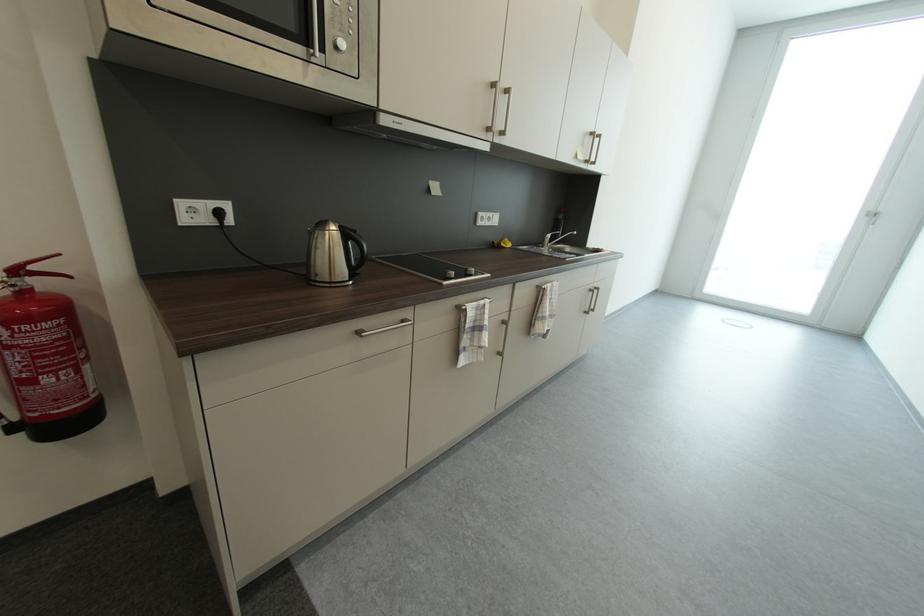
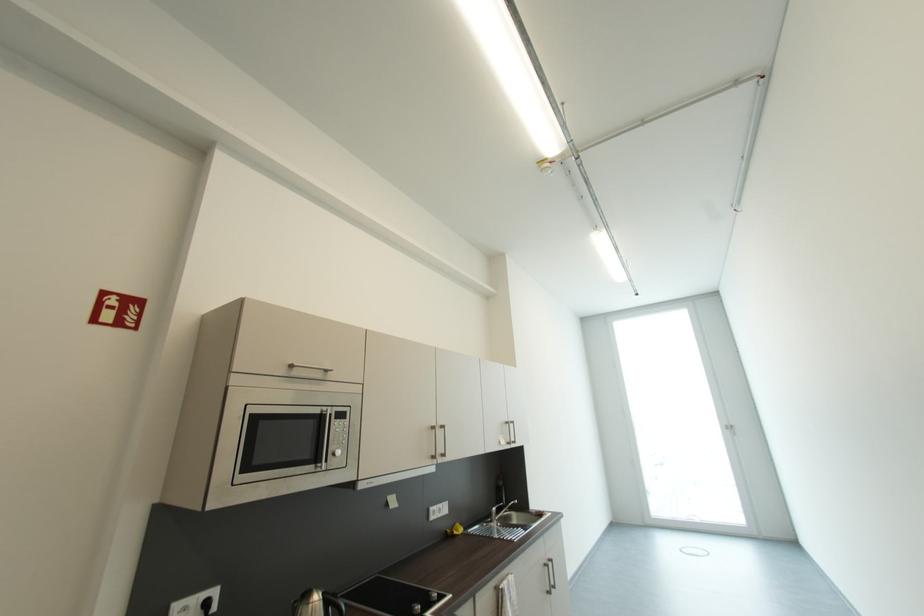
Locate, in the second image, the point that corresponds to the point at 334,235 in the first image.

(317, 607)